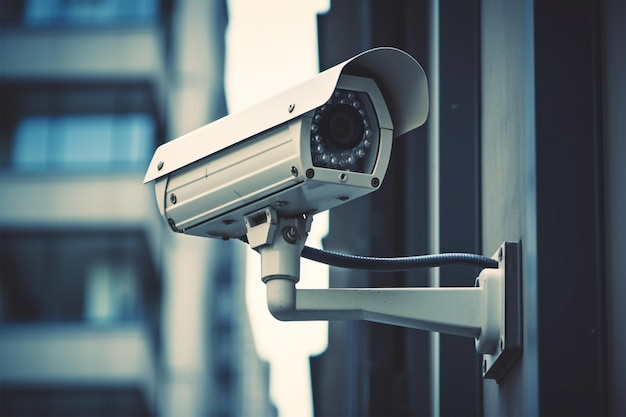
What are the coordinates of `cord wire` in the screenshot? It's located at (380, 262).